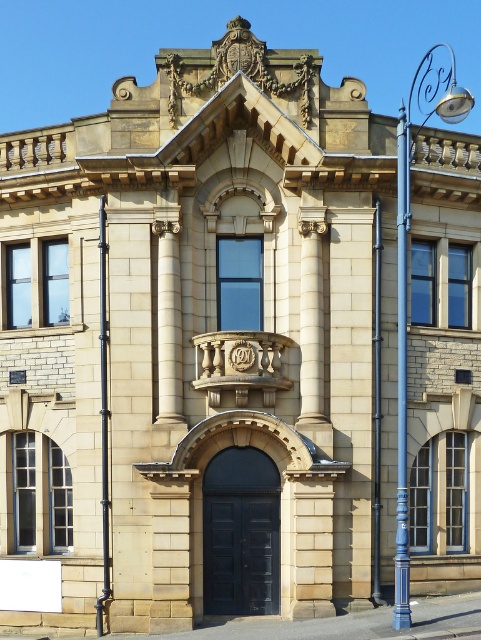
Question: Is black pipe at center wider than black metal pole at center?

Choices:
 (A) no
 (B) yes

Answer: (B)

Question: Which point appears farthest from the camera in this image?

Choices:
 (A) (376, 573)
 (B) (106, 396)

Answer: (B)

Question: Considering the real-world distances, which object is farthest from the blue metallic pole at right?

Choices:
 (A) black metal pole at center
 (B) black pipe at center

Answer: (B)

Question: Which object is the closest to the blue metallic pole at right?

Choices:
 (A) black metal pole at center
 (B) black pipe at center

Answer: (A)

Question: Does blue metallic pole at right have a larger size compared to black metal pole at center?

Choices:
 (A) yes
 (B) no

Answer: (A)

Question: Can you confirm if black pipe at center is wider than black metal pole at center?

Choices:
 (A) yes
 (B) no

Answer: (A)